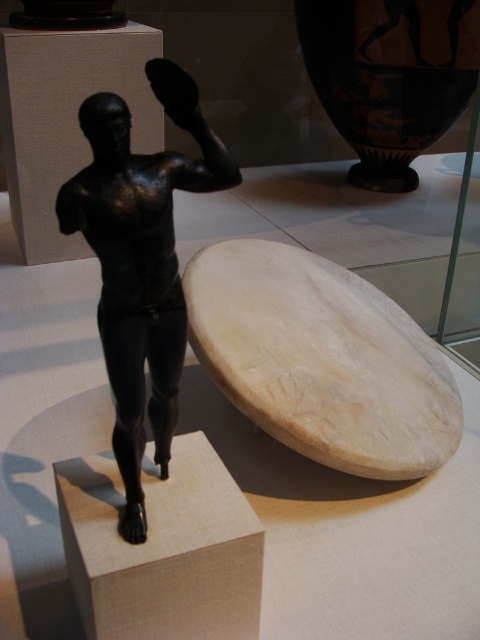
Question: Which point is closer to the camera taking this photo?

Choices:
 (A) (173, 332)
 (B) (437, 458)

Answer: (A)

Question: Which point is farther to the camera?

Choices:
 (A) white marble surfboard at lower center
 (B) shiny black statue at center

Answer: (A)

Question: Does white marble surfboard at lower center have a lesser width compared to shiny black statue at center?

Choices:
 (A) yes
 (B) no

Answer: (B)

Question: Does white marble surfboard at lower center have a greater width compared to shiny black statue at center?

Choices:
 (A) no
 (B) yes

Answer: (B)

Question: Does white marble surfboard at lower center lie in front of shiny black statue at center?

Choices:
 (A) yes
 (B) no

Answer: (B)